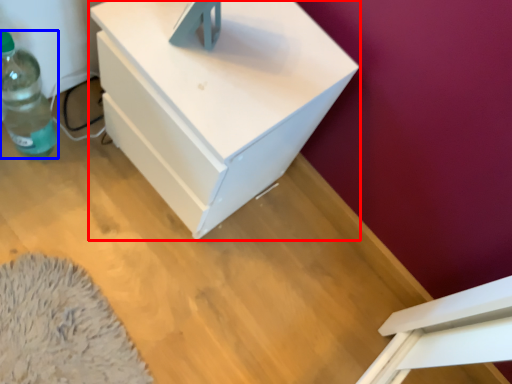
Question: Which of the following is the farthest to the observer, nightstand (highlighted by a red box) or bottle (highlighted by a blue box)?

Choices:
 (A) nightstand
 (B) bottle

Answer: (B)